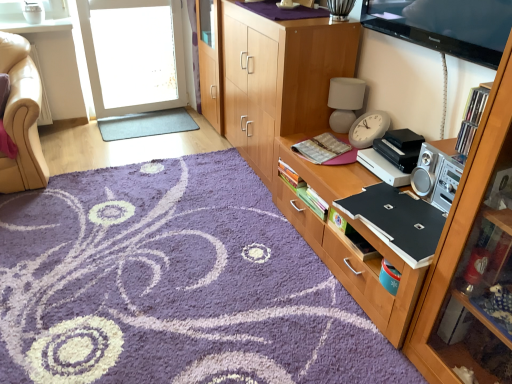
Question: Is wooden cabinet at center, arranged as the 1th cabinetry when viewed from the back, wider or thinner than wooden cabinet at right, the third cabinetry positioned from the back?

Choices:
 (A) thin
 (B) wide

Answer: (B)

Question: Is wooden cabinet at center, the third cabinetry from the front, taller or shorter than wooden cabinet at right, arranged as the 1th cabinetry when viewed from the front?

Choices:
 (A) tall
 (B) short

Answer: (B)

Question: Based on their relative distances, which object is farther from the wooden cabinet at center, the third cabinetry from the front?

Choices:
 (A) gray rubber mat at center, the 1th plain in the top-to-bottom sequence
 (B) wooden cabinet at center, which is counted as the 2th cabinetry, starting from the back
 (C) black matte laptop at right
 (D) clear plastic cds at upper right
 (E) wooden cabinet at right, arranged as the 1th cabinetry when viewed from the front

Answer: (E)

Question: Estimate the real-world distances between objects in this image. Which object is farther from the gray rubber mat at center, the 1th plain in the top-to-bottom sequence?

Choices:
 (A) clear plastic cds at upper right
 (B) matte gray speaker at upper right
 (C) purple shaggy rug at center, positioned as the 1th plain in bottom-to-top order
 (D) wooden cabinet at center, which ranks as the second cabinetry in front-to-back order
 (E) black matte laptop at right

Answer: (A)